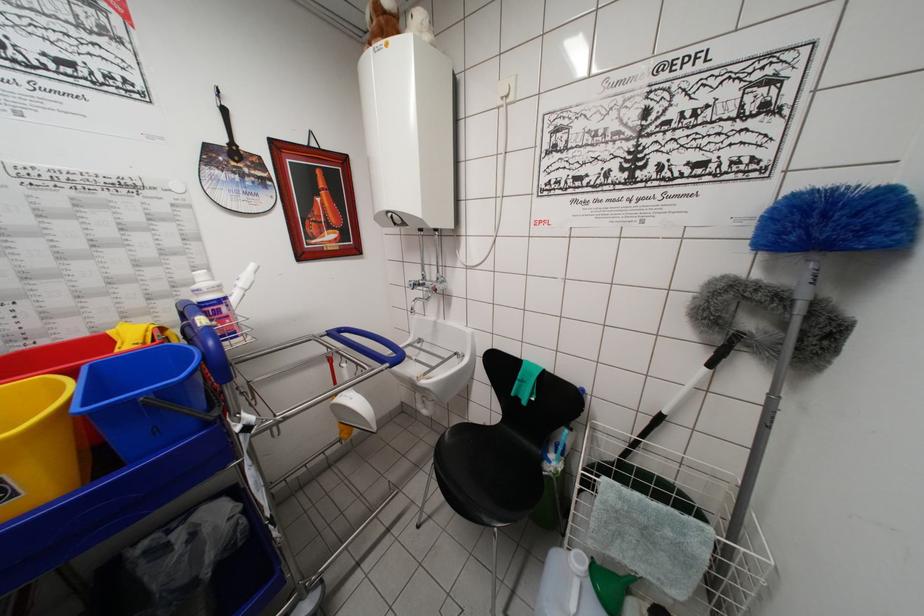
Where is `black chair sitting surface`? black chair sitting surface is located at coordinates (493, 476).